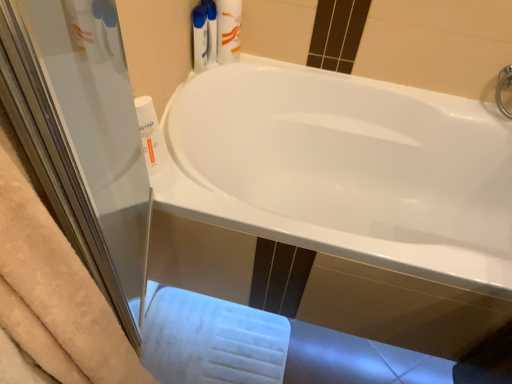
Question: Considering the relative positions of white plastic tube at upper center and white plastic bottle at left, the 2th cleaning product when ordered from back to front, in the image provided, is white plastic tube at upper center to the left of white plastic bottle at left, the 2th cleaning product when ordered from back to front, from the viewer's perspective?

Choices:
 (A) yes
 (B) no

Answer: (B)

Question: Is white plastic tube at upper center closer to the viewer compared to white plastic bottle at left, the 2th cleaning product when ordered from back to front?

Choices:
 (A) yes
 (B) no

Answer: (B)

Question: Can you confirm if white plastic tube at upper center is bigger than white plastic bottle at left, which is counted as the second cleaning product, starting from the top?

Choices:
 (A) no
 (B) yes

Answer: (B)

Question: From the image's perspective, would you say white plastic tube at upper center is shown under white plastic bottle at left, which is counted as the second cleaning product, starting from the top?

Choices:
 (A) no
 (B) yes

Answer: (A)

Question: Considering the relative sizes of white plastic tube at upper center and white plastic bottle at left, the 2th cleaning product positioned from the right, in the image provided, is white plastic tube at upper center shorter than white plastic bottle at left, the 2th cleaning product positioned from the right,?

Choices:
 (A) yes
 (B) no

Answer: (B)

Question: Does white plastic tube at upper center appear on the right side of white plastic bottle at left, positioned as the first cleaning product in front-to-back order?

Choices:
 (A) no
 (B) yes

Answer: (B)

Question: Considering the relative positions of white plastic bottle at left, the 2th cleaning product when ordered from back to front, and white plastic bottle at upper center, which is counted as the second cleaning product, starting from the bottom, in the image provided, is white plastic bottle at left, the 2th cleaning product when ordered from back to front, to the right of white plastic bottle at upper center, which is counted as the second cleaning product, starting from the bottom, from the viewer's perspective?

Choices:
 (A) yes
 (B) no

Answer: (B)

Question: Is white plastic bottle at upper center, which is counted as the second cleaning product, starting from the bottom, a part of white plastic bottle at left, the first cleaning product from the bottom?

Choices:
 (A) no
 (B) yes

Answer: (A)

Question: Is white plastic bottle at left, which is the first cleaning product from left to right, positioned behind white plastic bottle at upper center, which is counted as the first cleaning product, starting from the back?

Choices:
 (A) yes
 (B) no

Answer: (B)

Question: Is white plastic bottle at left, the 2th cleaning product positioned from the right, closer to camera compared to white plastic bottle at upper center, the 1th cleaning product viewed from the top?

Choices:
 (A) no
 (B) yes

Answer: (B)

Question: From the image's perspective, is white plastic bottle at left, the 2th cleaning product when ordered from back to front, below white plastic bottle at upper center, the 1th cleaning product viewed from the top?

Choices:
 (A) yes
 (B) no

Answer: (A)

Question: Can you see white plastic bottle at left, which is the first cleaning product from left to right, touching white plastic bottle at upper center, which is counted as the second cleaning product, starting from the bottom?

Choices:
 (A) no
 (B) yes

Answer: (A)

Question: Does white plastic bottle at left, the 2th cleaning product positioned from the right, contain white glossy bathtub at center?

Choices:
 (A) no
 (B) yes

Answer: (A)